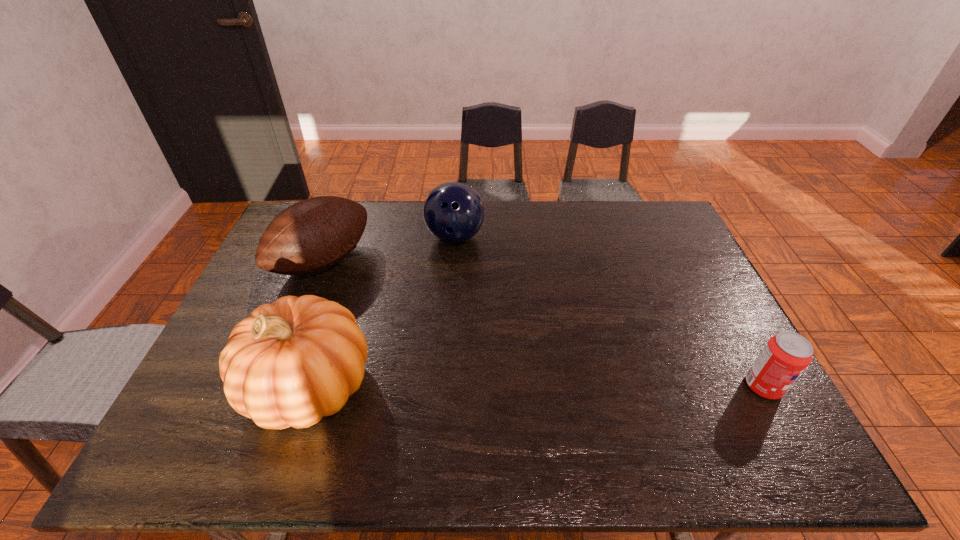
Locate an element on the screen. The width and height of the screenshot is (960, 540). vacant space on the desktop that is between the pumpkin and the soda can and is positioned on the laces of the football is located at coordinates (492, 386).

Identify the location of free space on the desktop that is between the tallest object and the rightmost object and is positioned on the surface of the third object from left to right near the finger holes. The width and height of the screenshot is (960, 540). (498, 386).